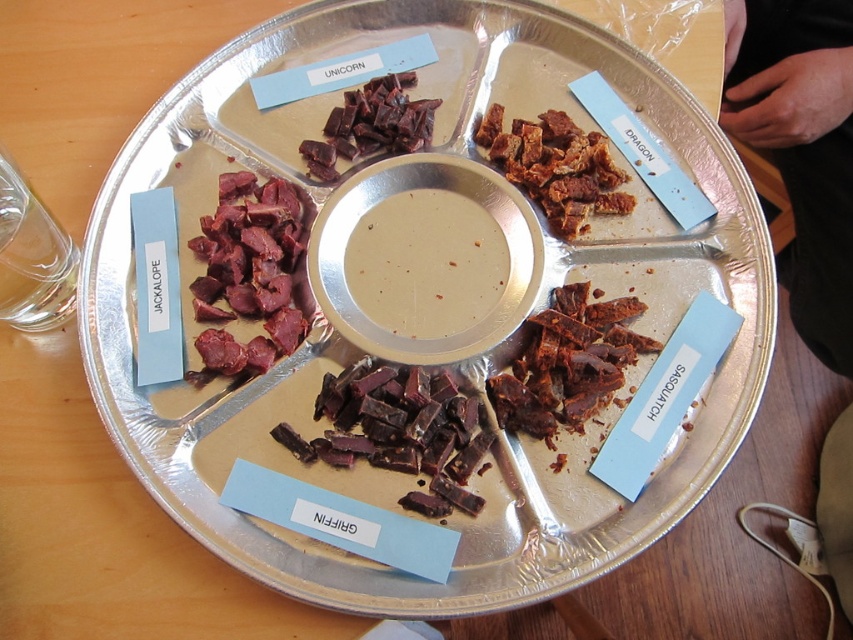
You are a food critic who needs to taste all the meats on the round aluminum tray. The tray is on a wooden table. You are currently holding a pair of tongs that can reach 30 centimeters. Which dark brown chewy meat can you reach without moving the tongs? The options are the dark brown chewy meat at center and the dark brown chewy meat at upper center.

The dark brown chewy meat at center is 29.17 centimeters away from the dark brown chewy meat at upper center. Since your tongs can reach 30 centimeters, you can reach both dark brown chewy meats.

You are at a tasting event and want to compare the height of the dark brown chewy meat at center and the brown crumbly snack at upper right. Which one is taller?

The brown crumbly snack at upper right is taller than the dark brown chewy meat at center.

You are at the wooden table and see the round aluminum tray with sections containing different meats. Which section has the dark brown chewy meat at center?

The dark brown chewy meat at center is located at point (399, 432), which corresponds to the Unicorn section at top center.